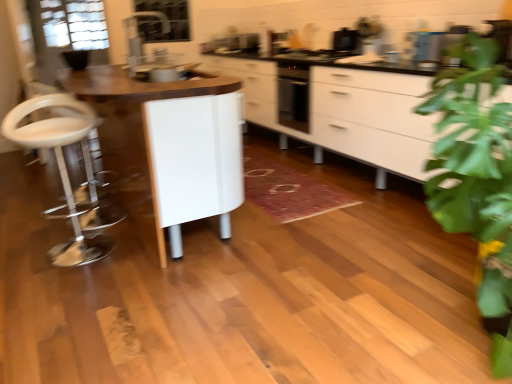
Identify the location of free space to the right of white glossy table at center. (302, 203).